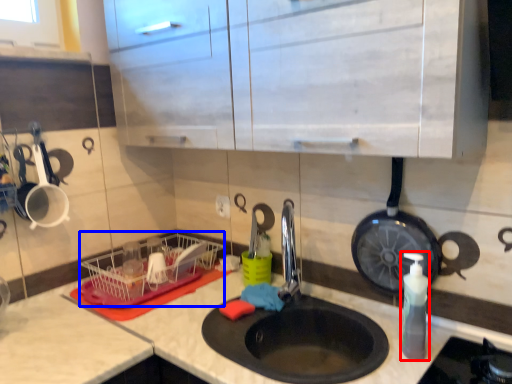
Question: Which of the following is the farthest to the observer, soap dispenser (highlighted by a red box) or basket (highlighted by a blue box)?

Choices:
 (A) soap dispenser
 (B) basket

Answer: (B)